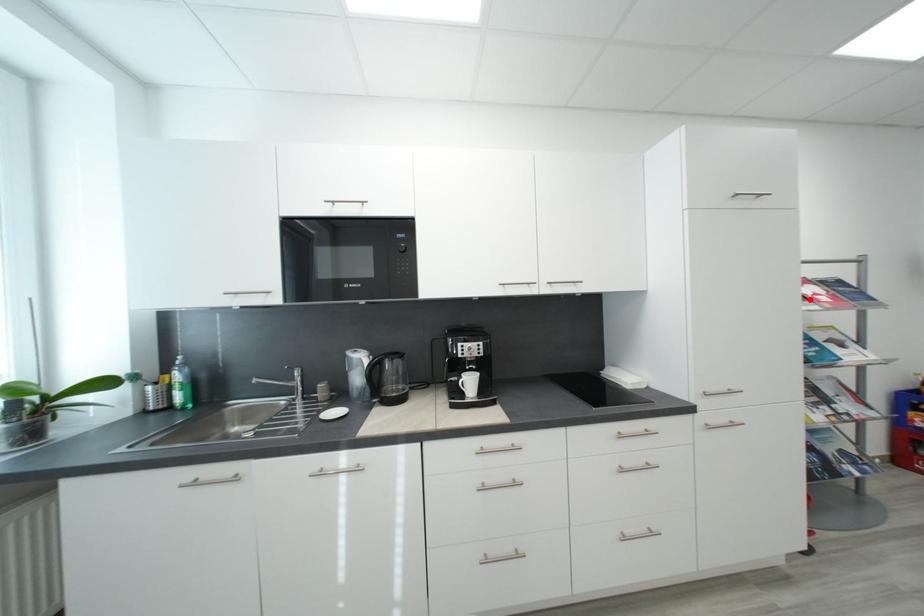
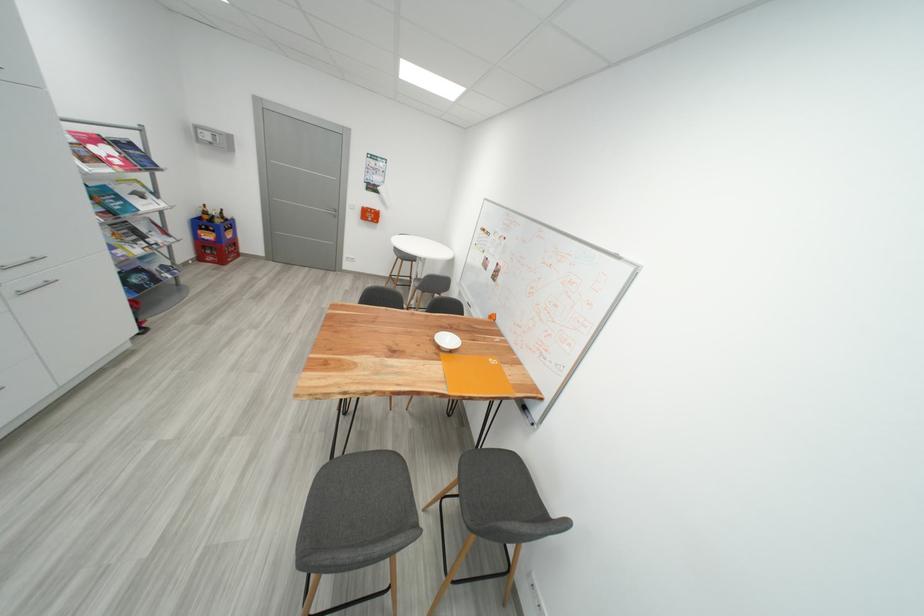
In the second image, find the point that corresponds to the highlighted location in the first image.

(104, 161)